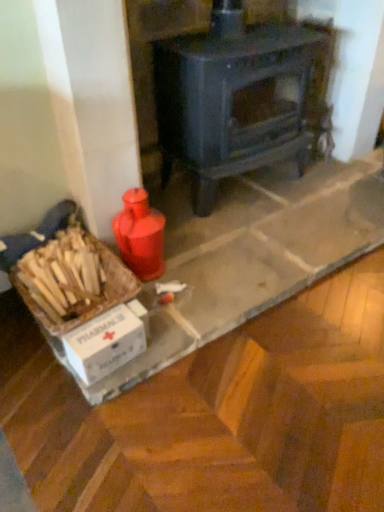
Find the location of a particular element. The height and width of the screenshot is (512, 384). free space underneath matte black wood burning stove at center (from a real-world perspective) is located at coordinates (246, 192).